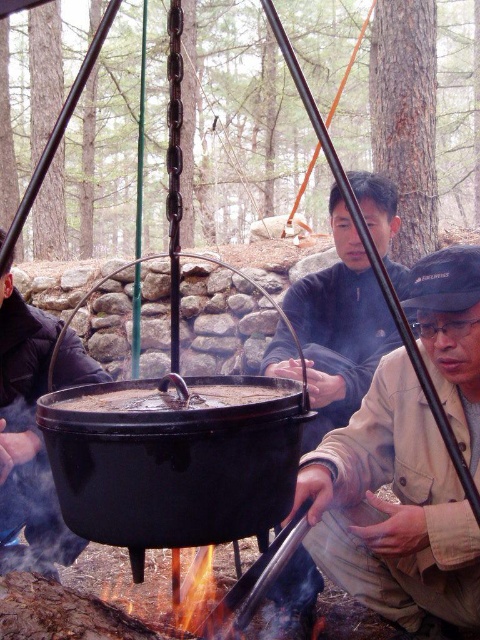
Describe the element at coordinates (394, 509) in the screenshot. I see `brown fabric jacket at lower right` at that location.

Identify the location of brown fabric jacket at lower right. (394, 509).

Does point (467, 620) come behind point (11, 424)?

No.

Where is `brown fabric jacket at lower right`? The height and width of the screenshot is (640, 480). brown fabric jacket at lower right is located at coordinates (394, 509).

Consider the image. Who is lower down, dark blue jacket at center or matte black jacket at center?

matte black jacket at center is lower down.

Based on the photo, who is more distant from viewer, (x=312, y=310) or (x=70, y=557)?

Point (x=312, y=310)

The height and width of the screenshot is (640, 480). I want to click on dark blue jacket at center, so point(338,326).

Does brown fabric jacket at lower right appear on the right side of black matte pot at center?

Correct, you'll find brown fabric jacket at lower right to the right of black matte pot at center.

Is point (471, 364) farther from viewer compared to point (206, 387)?

Yes.

Describe the element at coordinates (394, 509) in the screenshot. The width and height of the screenshot is (480, 640). I see `brown fabric jacket at lower right` at that location.

The width and height of the screenshot is (480, 640). I want to click on brown fabric jacket at lower right, so click(394, 509).